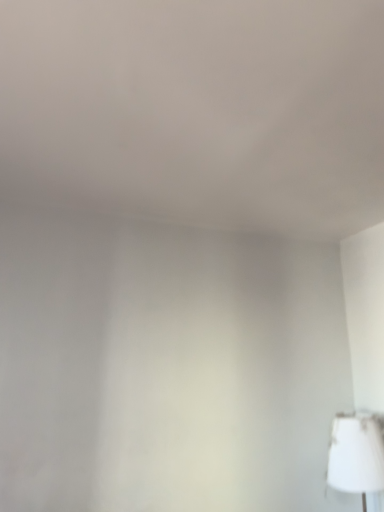
This screenshot has height=512, width=384. Describe the element at coordinates (357, 454) in the screenshot. I see `white fabric lampshade at lower right` at that location.

The height and width of the screenshot is (512, 384). I want to click on white fabric lampshade at lower right, so click(357, 454).

Locate an element on the screen. This screenshot has width=384, height=512. white fabric lampshade at lower right is located at coordinates (357, 454).